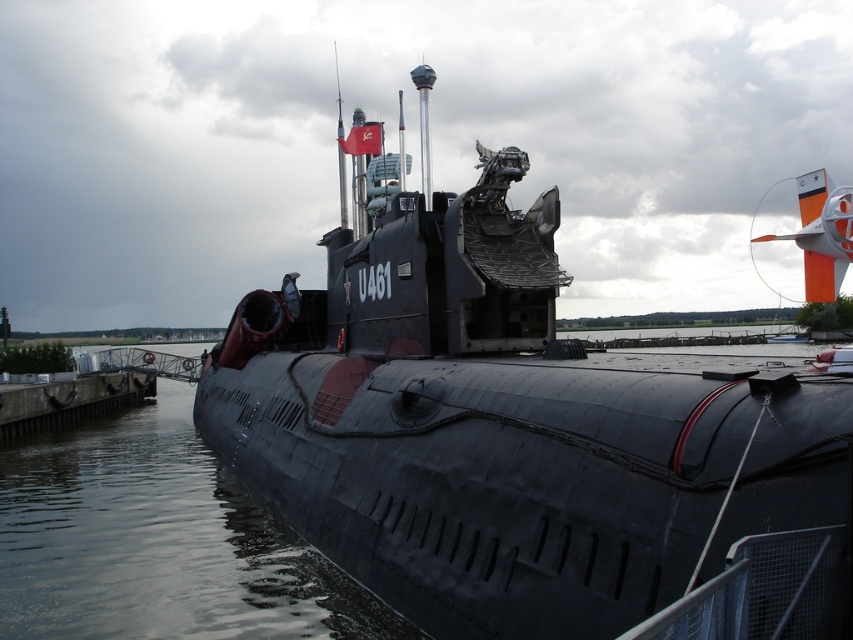
Is black rubber waterway at lower left further to the viewer compared to smooth concrete dock at lower left?

That is False.

Can you confirm if black rubber waterway at lower left is wider than smooth concrete dock at lower left?

Yes.

Who is more forward, (225, 611) or (73, 404)?

Point (225, 611) is more forward.

At what (x,y) coordinates should I click in order to perform the action: click on black rubber waterway at lower left. Please return your answer as a coordinate pair (x, y). Looking at the image, I should click on pyautogui.click(x=158, y=541).

Is matte black submarine at center thinner than smooth concrete dock at lower left?

No, matte black submarine at center is not thinner than smooth concrete dock at lower left.

Measure the distance between point [453,600] and camera.

Point [453,600] and camera are 8.13 meters apart.

Is point (482, 234) farther from camera compared to point (67, 404)?

No, it is not.

In order to click on matte black submarine at center in this screenshot , I will do `click(500, 420)`.

Is matte black submarine at center to the right of black rubber waterway at lower left from the viewer's perspective?

Correct, you'll find matte black submarine at center to the right of black rubber waterway at lower left.

Describe the element at coordinates (500, 420) in the screenshot. I see `matte black submarine at center` at that location.

You are a GUI agent. You are given a task and a screenshot of the screen. Output one action in this format:
    pyautogui.click(x=<x>, y=<y>)
    Task: Click on the matte black submarine at center
    This screenshot has height=640, width=853.
    Given the screenshot: What is the action you would take?
    pyautogui.click(x=500, y=420)

Identify the location of matte black submarine at center. The width and height of the screenshot is (853, 640). (500, 420).